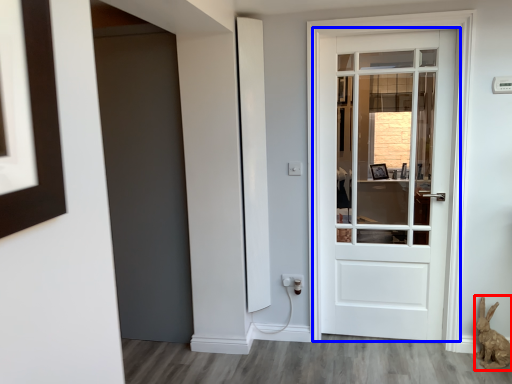
Question: Among these objects, which one is nearest to the camera, animal (highlighted by a red box) or door (highlighted by a blue box)?

Choices:
 (A) animal
 (B) door

Answer: (A)